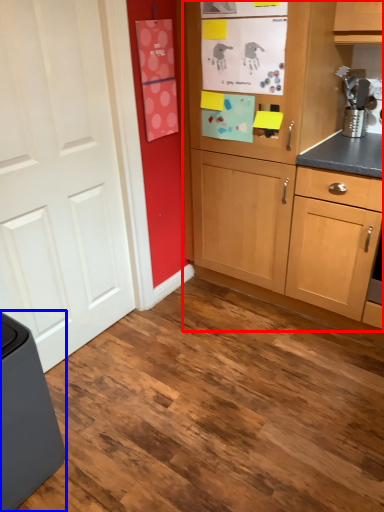
Question: Which of the following is the closest to the observer, cabinetry (highlighted by a red box) or home appliance (highlighted by a blue box)?

Choices:
 (A) cabinetry
 (B) home appliance

Answer: (B)